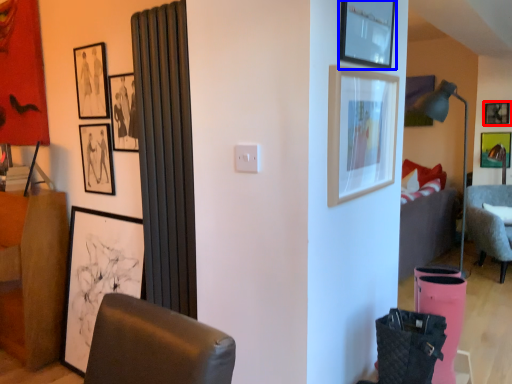
Question: Which object appears closest to the camera in this image, picture frame (highlighted by a red box) or picture frame (highlighted by a blue box)?

Choices:
 (A) picture frame
 (B) picture frame

Answer: (B)